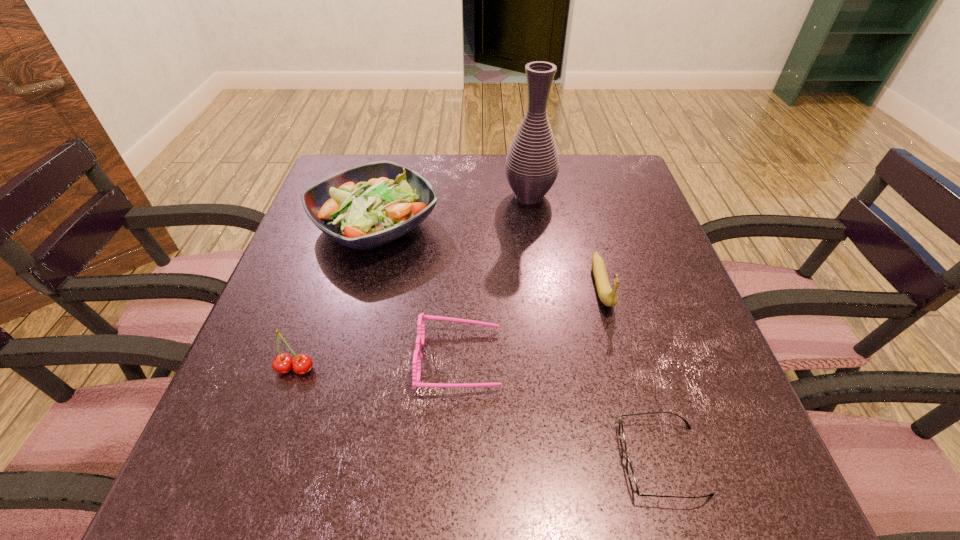
At what (x,y) coordinates should I click in order to perform the action: click on free spot between the banana and the salad plate. Please return your answer as a coordinate pair (x, y). Looking at the image, I should click on pyautogui.click(x=489, y=255).

You are a GUI agent. You are given a task and a screenshot of the screen. Output one action in this format:
    pyautogui.click(x=<x>, y=<y>)
    Task: Click on the unoccupied area between the salad plate and the farther spectacles
    Image resolution: width=960 pixels, height=540 pixels.
    Given the screenshot: What is the action you would take?
    point(418,292)

Find the location of `object that is the fourth nearest to the taller spectacles`. object that is the fourth nearest to the taller spectacles is located at coordinates (608, 297).

Image resolution: width=960 pixels, height=540 pixels. I want to click on object that is the fourth closest to the banana, so click(x=368, y=205).

The image size is (960, 540). I want to click on blank space that satisfies the following two spatial constraints: 1. at the stem of the banana; 2. on the arms of the farther spectacles, so click(x=621, y=359).